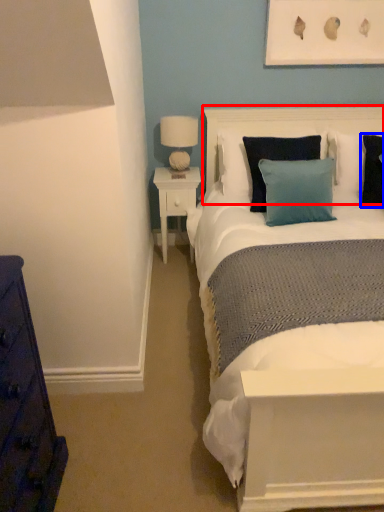
Question: Which point is further to the camera, headboard (highlighted by a red box) or pillow (highlighted by a blue box)?

Choices:
 (A) headboard
 (B) pillow

Answer: (A)